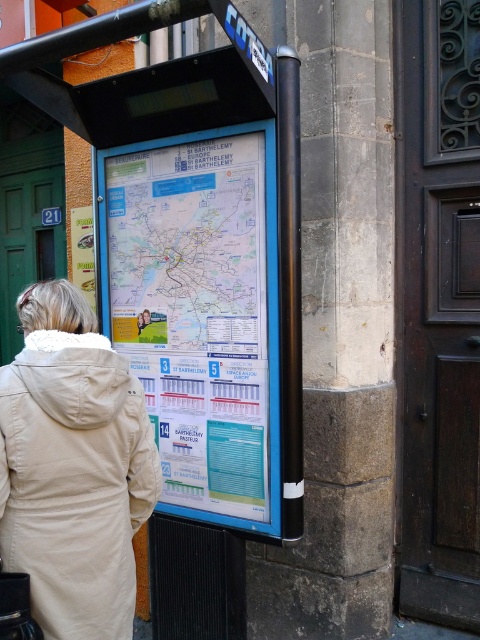
Question: Is white paper map at center positioned in front of beige fleece coat at lower left?

Choices:
 (A) yes
 (B) no

Answer: (B)

Question: Is blue plastic signboard at center in front of beige fleece coat at lower left?

Choices:
 (A) yes
 (B) no

Answer: (B)

Question: Among these objects, which one is nearest to the camera?

Choices:
 (A) beige fleece coat at lower left
 (B) white paper map at center

Answer: (A)

Question: Which object is farther from the camera taking this photo?

Choices:
 (A) blue plastic signboard at center
 (B) white paper map at center
 (C) beige fleece coat at lower left

Answer: (B)

Question: Can you confirm if blue plastic signboard at center is positioned to the left of white paper map at center?

Choices:
 (A) no
 (B) yes

Answer: (B)

Question: Which object is farther from the camera taking this photo?

Choices:
 (A) white paper map at center
 (B) blue plastic signboard at center
 (C) beige fleece coat at lower left

Answer: (A)